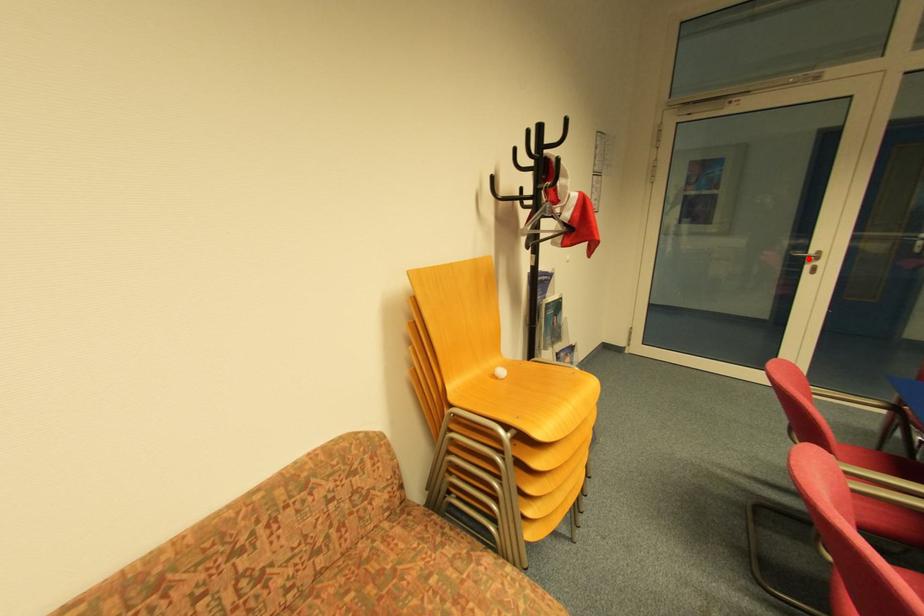
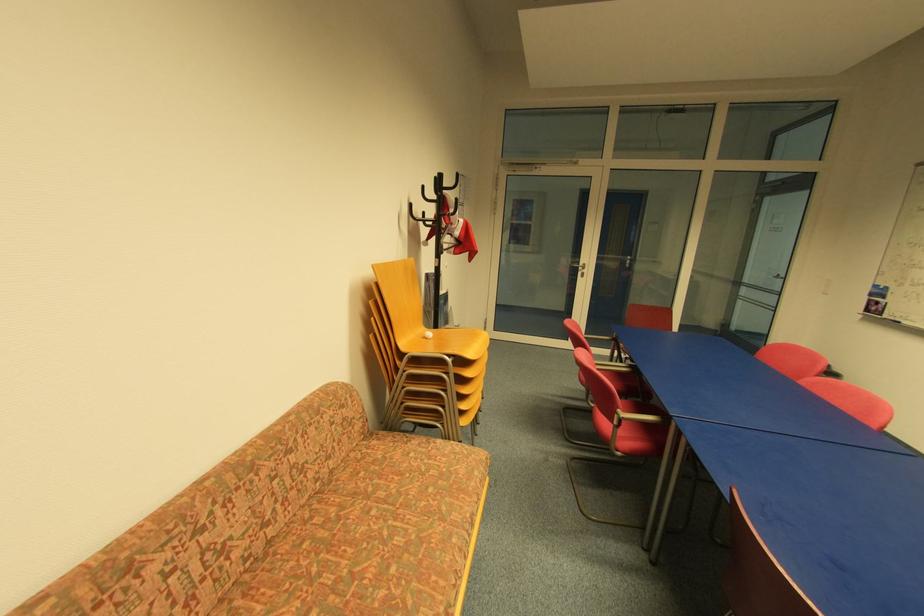
Question: I am providing you with two images of the same scene from different viewpoints. Given a red point in image1, look at the same physical point in image2. Is it:

Choices:
 (A) Closer to the viewpoint
 (B) Farther from the viewpoint

Answer: (A)